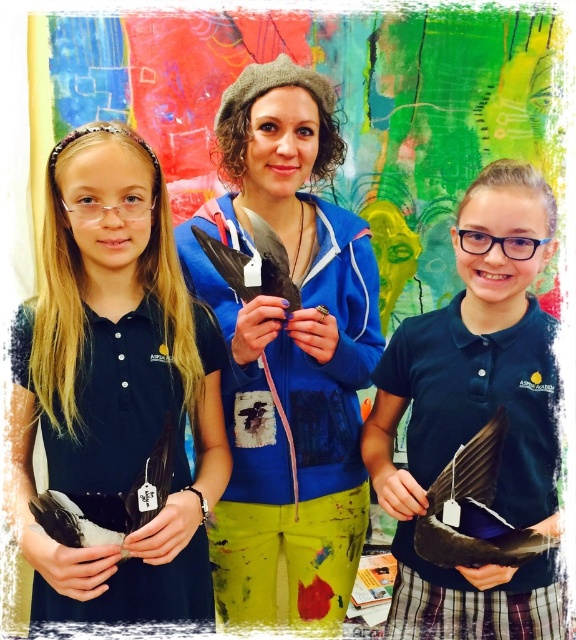
Question: Among these objects, which one is farthest from the camera?

Choices:
 (A) matte black feather at center
 (B) matte black feather at right
 (C) black matte feather at left

Answer: (A)

Question: Which of the following is the closest to the observer?

Choices:
 (A) click(259, 500)
 (B) click(202, 330)
 (C) click(395, 605)

Answer: (B)

Question: Which point is closer to the camera?

Choices:
 (A) matte black feather at right
 (B) black matte feather at left
 (C) matte black feather at center

Answer: (B)

Question: Where is black matte feather at left located in relation to matte black feather at center in the image?

Choices:
 (A) below
 (B) above

Answer: (A)

Question: Does matte black feather at center have a greater width compared to matte black feather at right?

Choices:
 (A) yes
 (B) no

Answer: (A)

Question: Does matte black feather at center have a greater width compared to matte black feather at right?

Choices:
 (A) no
 (B) yes

Answer: (B)